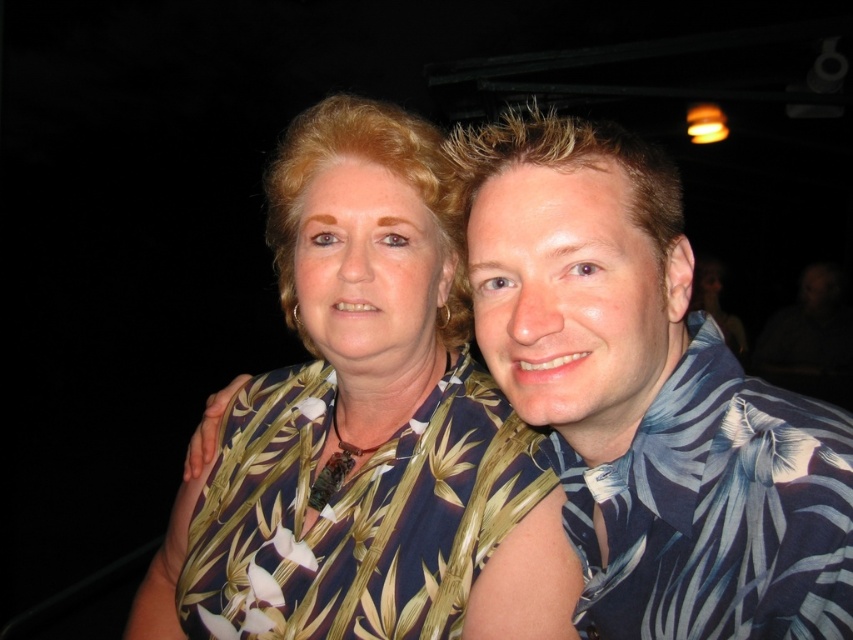
Question: Where is printed fabric blouse at center located in relation to blue floral shirt at right in the image?

Choices:
 (A) left
 (B) right

Answer: (A)

Question: Which object appears closest to the camera in this image?

Choices:
 (A) blue floral shirt at right
 (B) blue floral shirt at center

Answer: (B)

Question: Which point is closer to the camera taking this photo?

Choices:
 (A) (734, 488)
 (B) (310, 291)
 (C) (608, 186)

Answer: (A)

Question: Is printed fabric blouse at center smaller than blue floral shirt at right?

Choices:
 (A) yes
 (B) no

Answer: (B)

Question: Does printed fabric blouse at center appear on the left side of blue floral shirt at center?

Choices:
 (A) no
 (B) yes

Answer: (B)

Question: Estimate the real-world distances between objects in this image. Which object is closer to the blue floral shirt at right?

Choices:
 (A) printed fabric blouse at center
 (B) blue floral shirt at center

Answer: (B)